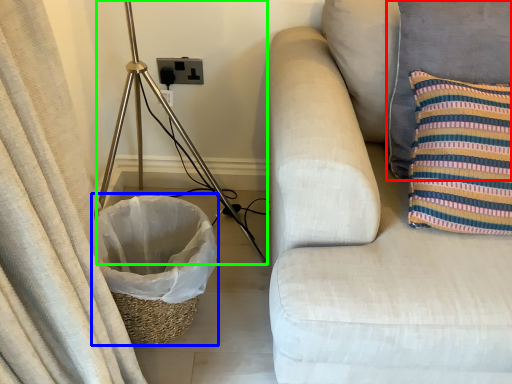
Question: Which is farther away from pillow (highlighted by a red box)? laundry basket (highlighted by a blue box) or tripod (highlighted by a green box)?

Choices:
 (A) laundry basket
 (B) tripod

Answer: (B)